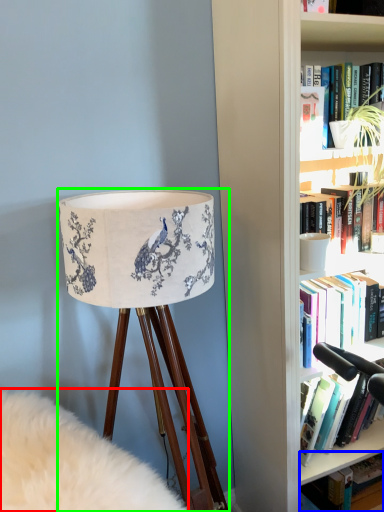
Question: Considering the real-world distances, which object is farthest from plain (highlighted by a red box)? book (highlighted by a blue box) or lamp (highlighted by a green box)?

Choices:
 (A) book
 (B) lamp

Answer: (A)